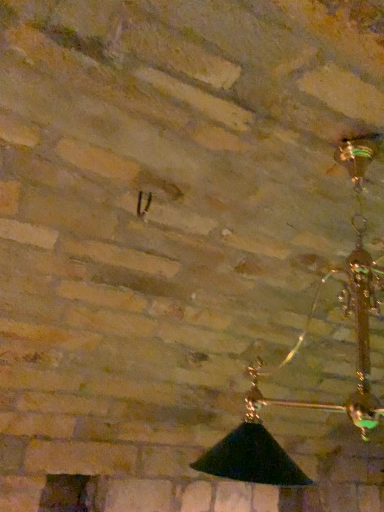
Where is `black glass lampshade at upper right`? black glass lampshade at upper right is located at coordinates (297, 350).

Measure the distance between black glass lampshade at upper right and camera.

They are 8.68 feet apart.

What do you see at coordinates (297, 350) in the screenshot? The image size is (384, 512). I see `black glass lampshade at upper right` at bounding box center [297, 350].

You are a GUI agent. You are given a task and a screenshot of the screen. Output one action in this format:
    pyautogui.click(x=<x>, y=<y>)
    Task: Click on the black glass lampshade at upper right
    This screenshot has width=384, height=512.
    Given the screenshot: What is the action you would take?
    pyautogui.click(x=297, y=350)